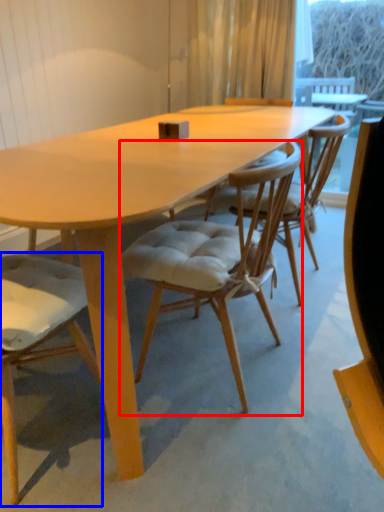
Question: Which point is closer to the camera, chair (highlighted by a red box) or chair (highlighted by a blue box)?

Choices:
 (A) chair
 (B) chair

Answer: (B)